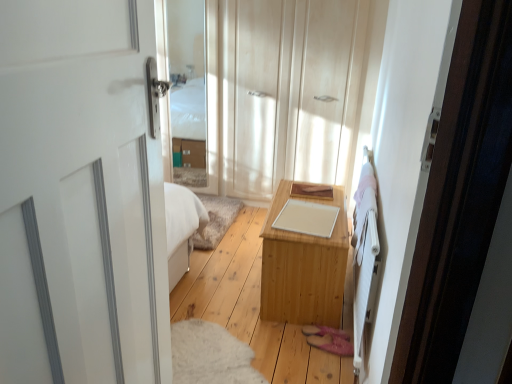
Question: Is white wooden bed frame at right thinner than clear glass mirror at upper center?

Choices:
 (A) yes
 (B) no

Answer: (B)

Question: Is white wooden bed frame at right oriented towards clear glass mirror at upper center?

Choices:
 (A) no
 (B) yes

Answer: (A)

Question: Can you confirm if white wooden bed frame at right is shorter than clear glass mirror at upper center?

Choices:
 (A) yes
 (B) no

Answer: (A)

Question: Is white wooden bed frame at right to the left of clear glass mirror at upper center from the viewer's perspective?

Choices:
 (A) yes
 (B) no

Answer: (B)

Question: Is white wooden bed frame at right bigger than clear glass mirror at upper center?

Choices:
 (A) yes
 (B) no

Answer: (A)

Question: Considering their positions, is light wood table at center located in front of or behind white glossy door at left?

Choices:
 (A) front
 (B) behind

Answer: (B)

Question: Based on their sizes in the image, would you say light wood table at center is bigger or smaller than white glossy door at left?

Choices:
 (A) small
 (B) big

Answer: (B)

Question: Considering the positions of light wood table at center and white glossy door at left in the image, is light wood table at center taller or shorter than white glossy door at left?

Choices:
 (A) tall
 (B) short

Answer: (B)

Question: Considering the relative positions of light wood table at center and white glossy door at left in the image provided, is light wood table at center to the left or to the right of white glossy door at left?

Choices:
 (A) right
 (B) left

Answer: (A)

Question: Based on their positions, is white wooden bed frame at right located to the left or right of light wood table at center?

Choices:
 (A) left
 (B) right

Answer: (B)

Question: In terms of size, does white wooden bed frame at right appear bigger or smaller than light wood table at center?

Choices:
 (A) big
 (B) small

Answer: (B)

Question: From their relative heights in the image, would you say white wooden bed frame at right is taller or shorter than light wood table at center?

Choices:
 (A) short
 (B) tall

Answer: (A)

Question: Considering the positions of white wooden bed frame at right and light wood table at center in the image, is white wooden bed frame at right wider or thinner than light wood table at center?

Choices:
 (A) wide
 (B) thin

Answer: (B)

Question: From a real-world perspective, is white glossy door at left above or below light wood dresser at center?

Choices:
 (A) above
 (B) below

Answer: (A)

Question: From the image's perspective, relative to light wood dresser at center, is white glossy door at left above or below?

Choices:
 (A) below
 (B) above

Answer: (A)